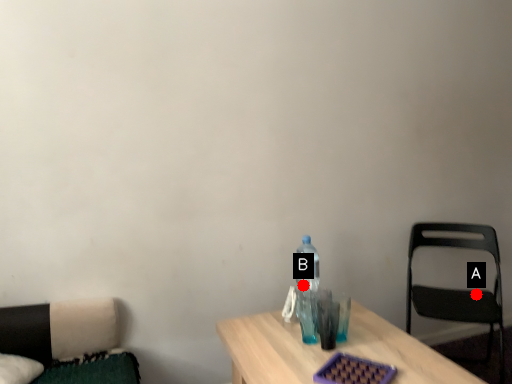
Question: Two points are circled on the image, labeled by A and B beside each circle. Which point is further to the camera?

Choices:
 (A) A is further
 (B) B is further

Answer: (A)